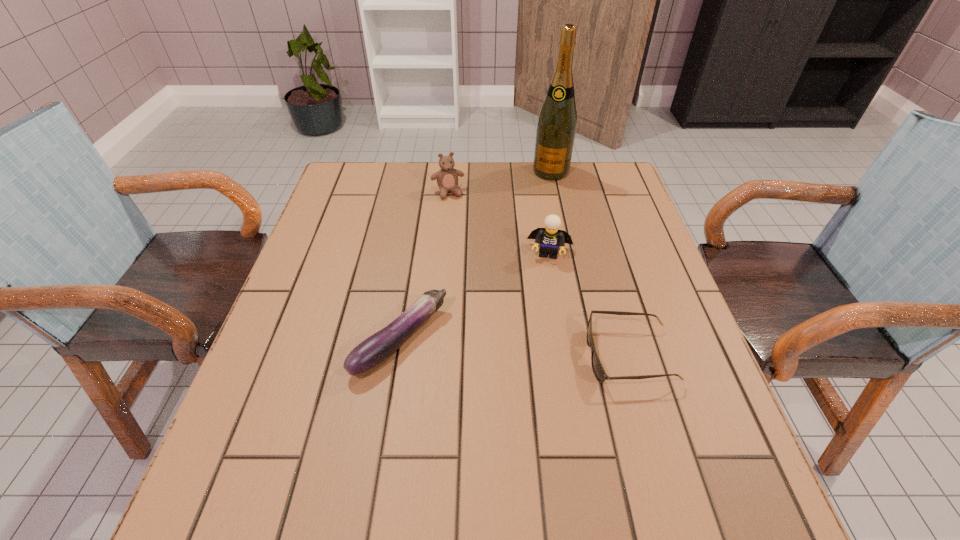
The width and height of the screenshot is (960, 540). Identify the location of vacant region that satisfies the following two spatial constraints: 1. on the front side of the sunglasses; 2. on the lenses of the third nearest object. (568, 356).

Locate an element on the screen. free space in the image that satisfies the following two spatial constraints: 1. on the back side of the wine bottle; 2. on the right side of the third nearest object is located at coordinates (537, 171).

Identify the location of free location that satisfies the following two spatial constraints: 1. on the front side of the Lego; 2. on the lenses of the shortest object. (568, 356).

Identify the location of vacant region that satisfies the following two spatial constraints: 1. on the back side of the wine bottle; 2. on the left side of the fourth tallest object. The width and height of the screenshot is (960, 540). (427, 171).

Locate an element on the screen. The width and height of the screenshot is (960, 540). free space that satisfies the following two spatial constraints: 1. on the back side of the Lego; 2. on the right side of the eggplant is located at coordinates (415, 253).